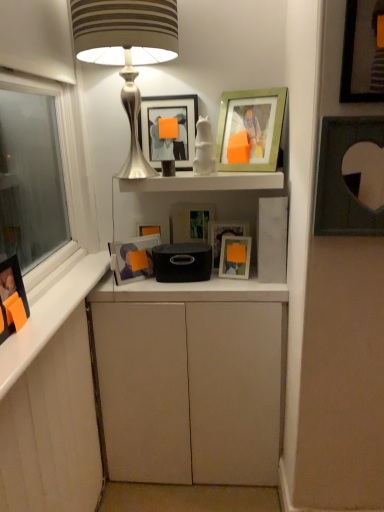
Question: Is point (142, 121) closer or farther from the camera than point (201, 379)?

Choices:
 (A) farther
 (B) closer

Answer: (A)

Question: Considering the relative positions of matte black picture frame at upper center, which appears as the 7th picture frame when viewed from the right, and matte white cabinet at center in the image provided, is matte black picture frame at upper center, which appears as the 7th picture frame when viewed from the right, to the left or to the right of matte white cabinet at center?

Choices:
 (A) right
 (B) left

Answer: (B)

Question: Which of these objects is positioned farthest from the matte black picture frame at upper right, placed as the eighth picture frame when sorted from left to right?

Choices:
 (A) matte silver picture frame at center, arranged as the 6th picture frame when viewed from the left
 (B) matte white cabinet at center
 (C) matte black picture frame at upper center, the third picture frame when ordered from left to right
 (D) matte glass picture frame at center, which is the 8th picture frame in right-to-left order
 (E) matte black picture frame at upper right, which is the first picture frame from right to left

Answer: (D)

Question: Which object is positioned farthest from the matte white cabinet at center?

Choices:
 (A) silver metallic lamp at upper center
 (B) matte silver picture frame at center, arranged as the 6th picture frame when viewed from the left
 (C) matte black picture frame at upper right, placed as the eighth picture frame when sorted from left to right
 (D) matte black picture frame at upper center, which appears as the 7th picture frame when viewed from the right
 (E) matte glass picture frame at center, which is the 8th picture frame in right-to-left order

Answer: (A)